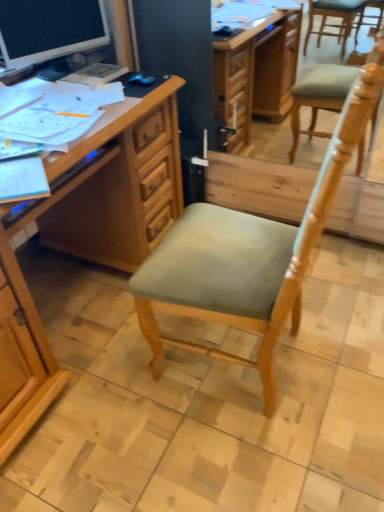
Question: From a real-world perspective, is wooden desk at left physically located above or below light green fabric chair at center?

Choices:
 (A) above
 (B) below

Answer: (B)

Question: Is wooden desk at left situated inside light green fabric chair at center or outside?

Choices:
 (A) inside
 (B) outside

Answer: (B)

Question: Which of these objects is positioned closest to the wooden desk at left?

Choices:
 (A) matte black monitor at upper left
 (B) light green fabric chair at center

Answer: (B)

Question: Considering the real-world distances, which object is closest to the wooden desk at left?

Choices:
 (A) matte black monitor at upper left
 (B) light green fabric chair at center

Answer: (B)